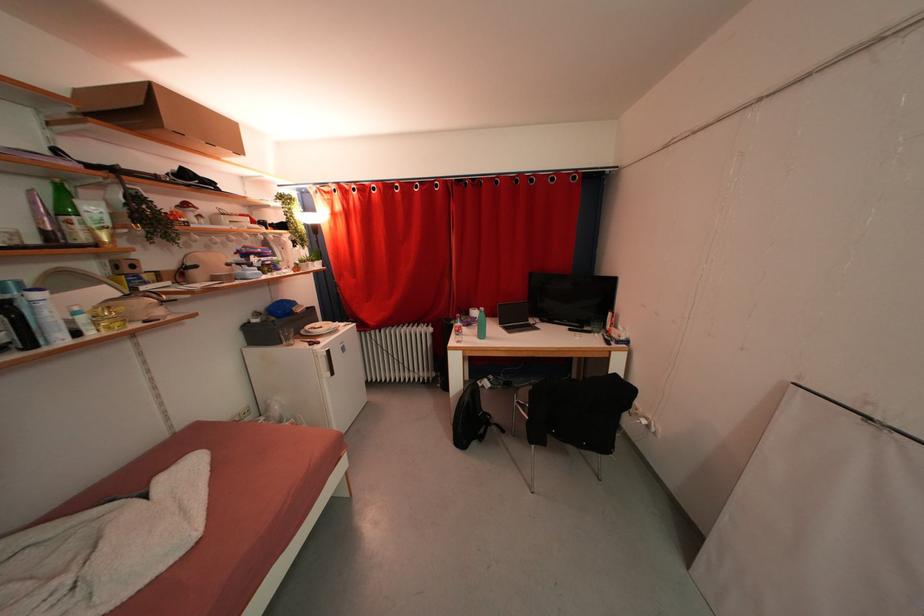
Describe the element at coordinates (68, 215) in the screenshot. I see `the green glass bottle` at that location.